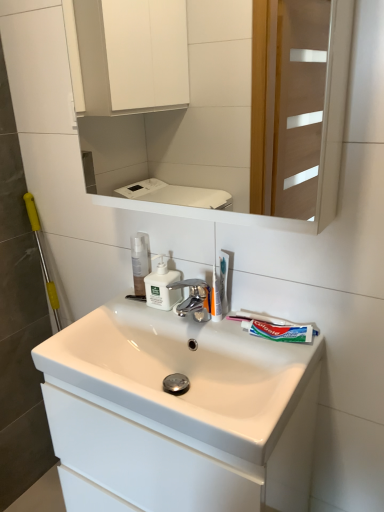
Describe the element at coordinates (215, 298) in the screenshot. I see `translucent plastic toothbrush at center` at that location.

This screenshot has height=512, width=384. In order to click on white matte cabinet at upper center in this screenshot , I will do `click(316, 116)`.

This screenshot has height=512, width=384. Find the location of `white matte soap dispenser at center`. white matte soap dispenser at center is located at coordinates (162, 287).

Locate an element on the screen. Image resolution: width=384 pixels, height=512 pixels. translucent plastic toothbrush at upper center is located at coordinates (223, 280).

The height and width of the screenshot is (512, 384). What do you see at coordinates (280, 331) in the screenshot?
I see `white matte toothpaste at right` at bounding box center [280, 331].

This screenshot has height=512, width=384. I want to click on translucent plastic toothbrush at center, so click(x=215, y=298).

From a real-world perspective, is white glossy sink at center physically below white matte soap dispenser at center?

Correct, in the physical world, white glossy sink at center is lower than white matte soap dispenser at center.

Which of these two, white glossy sink at center or white matte soap dispenser at center, is wider?

Wider between the two is white glossy sink at center.

Considering the relative sizes of white glossy sink at center and white matte soap dispenser at center in the image provided, is white glossy sink at center taller than white matte soap dispenser at center?

Yes.

Is white glossy sink at center facing away from white matte soap dispenser at center?

No, white glossy sink at center is not facing the opposite direction of white matte soap dispenser at center.

The width and height of the screenshot is (384, 512). I want to click on bathroom cabinet that appears below the translucent plastic toothbrush at upper center (from a real-world perspective), so click(x=177, y=457).

Considering the relative sizes of translucent plastic toothbrush at upper center and white glossy sink at center in the image provided, is translucent plastic toothbrush at upper center taller than white glossy sink at center?

No.

Is translucent plastic toothbrush at upper center wider than white glossy sink at center?

No.

Based on their positions, is translucent plastic toothbrush at upper center located to the left or right of white glossy sink at center?

Based on their positions, translucent plastic toothbrush at upper center is located to the right of white glossy sink at center.

Is white matte toothpaste at right inside white glossy sink at center?

No, white matte toothpaste at right is not a part of white glossy sink at center.

In the scene shown: Is white glossy sink at center positioned behind white matte toothpaste at right?

No, it is in front of white matte toothpaste at right.

From the image's perspective, between white glossy sink at center and white matte toothpaste at right, which one is located above?

white matte toothpaste at right, from the image's perspective.

You are a GUI agent. You are given a task and a screenshot of the screen. Output one action in this format:
    pyautogui.click(x=<x>, y=<y>)
    Task: Click on the bathroom cabinet below the white matte toothpaste at right (from the image's perspective)
    This screenshot has width=384, height=512.
    Given the screenshot: What is the action you would take?
    pyautogui.click(x=177, y=457)

Can you tell me how much transparent plastic mouthwash at center and white matte cabinet at upper center differ in facing direction?

The angular difference between transparent plastic mouthwash at center and white matte cabinet at upper center is 2.8 degrees.

In the image, is transparent plastic mouthwash at center positioned in front of or behind white matte cabinet at upper center?

transparent plastic mouthwash at center is behind white matte cabinet at upper center.

Does transparent plastic mouthwash at center have a greater width compared to white matte cabinet at upper center?

In fact, transparent plastic mouthwash at center might be narrower than white matte cabinet at upper center.

Which is nearer, (212,303) or (221,268)?

Point (212,303) appears to be closer to the viewer than point (221,268).

Between translucent plastic toothbrush at center and translucent plastic toothbrush at upper center, which one has larger size?

With larger size is translucent plastic toothbrush at center.

Could you tell me if translucent plastic toothbrush at center is turned towards translucent plastic toothbrush at upper center?

Yes, translucent plastic toothbrush at center is oriented towards translucent plastic toothbrush at upper center.

Is translucent plastic toothbrush at center inside the boundaries of translucent plastic toothbrush at upper center, or outside?

translucent plastic toothbrush at center is not inside translucent plastic toothbrush at upper center, it's outside.

In the scene shown: Can you tell me how much transparent plastic mouthwash at center and white matte toothpaste at right differ in facing direction?

5.69 degrees.

Is transparent plastic mouthwash at center facing towards white matte toothpaste at right?

No.

What are the coordinates of `toothpaste in front of the transparent plastic mouthwash at center` in the screenshot? It's located at (280, 331).

Is transparent plastic mouthwash at center not near white matte toothpaste at right?

Actually, transparent plastic mouthwash at center and white matte toothpaste at right are a little close together.

From a real-world perspective, is translucent plastic toothbrush at center positioned over white glossy sink at center based on gravity?

Yes.

Who is taller, translucent plastic toothbrush at center or white glossy sink at center?

white glossy sink at center is taller.

Does translucent plastic toothbrush at center touch white glossy sink at center?

No, translucent plastic toothbrush at center is not beside white glossy sink at center.

Is translucent plastic toothbrush at center not within white glossy sink at center?

translucent plastic toothbrush at center lies outside white glossy sink at center's area.

Locate an element on the screen. soap dispenser behind the white glossy sink at center is located at coordinates (162, 287).

What are the coordinates of `bathroom cabinet lying below the translucent plastic toothbrush at upper center (from the image's perspective)` in the screenshot? It's located at click(x=177, y=457).

When comparing their distances from transparent plastic mouthwash at center, does white matte toothpaste at right or white glossy sink at center seem closer?

The object closer to transparent plastic mouthwash at center is white matte toothpaste at right.

Considering their positions, is white matte toothpaste at right positioned further to white matte cabinet at upper center than transparent plastic mouthwash at center?

white matte toothpaste at right lies further to white matte cabinet at upper center than the other object.

From the picture: Estimate the real-world distances between objects in this image. Which object is further from white matte cabinet at upper center, translucent plastic toothbrush at upper center or white matte soap dispenser at center?

translucent plastic toothbrush at upper center is further to white matte cabinet at upper center.

Based on their spatial positions, is white matte toothpaste at right or translucent plastic toothbrush at upper center further from white glossy sink at center?

translucent plastic toothbrush at upper center is further to white glossy sink at center.

Looking at the image, which one is located closer to transparent plastic mouthwash at center, translucent plastic toothbrush at center or white glossy sink at center?

translucent plastic toothbrush at center lies closer to transparent plastic mouthwash at center than the other object.

Looking at the image, which one is located closer to translucent plastic toothbrush at center, transparent plastic mouthwash at center or translucent plastic toothbrush at upper center?

Based on the image, translucent plastic toothbrush at upper center appears to be nearer to translucent plastic toothbrush at center.

Based on their spatial positions, is white glossy sink at center or white matte cabinet at upper center closer to translucent plastic toothbrush at center?

white glossy sink at center is closer to translucent plastic toothbrush at center.

From the picture: Estimate the real-world distances between objects in this image. Which object is further from white glossy sink at center, translucent plastic toothbrush at upper center or translucent plastic toothbrush at center?

The object further to white glossy sink at center is translucent plastic toothbrush at upper center.

Identify the location of toothpaste that lies between transparent plastic mouthwash at center and white glossy sink at center from top to bottom. The width and height of the screenshot is (384, 512). (280, 331).

Locate an element on the screen. toothbrush between white matte cabinet at upper center and white matte soap dispenser at center along the z-axis is located at coordinates (223, 280).

I want to click on soap dispenser between white matte cabinet at upper center and white glossy sink at center in the vertical direction, so [x=162, y=287].

I want to click on toothbrush between white matte cabinet at upper center and white glossy sink at center in the up-down direction, so click(223, 280).